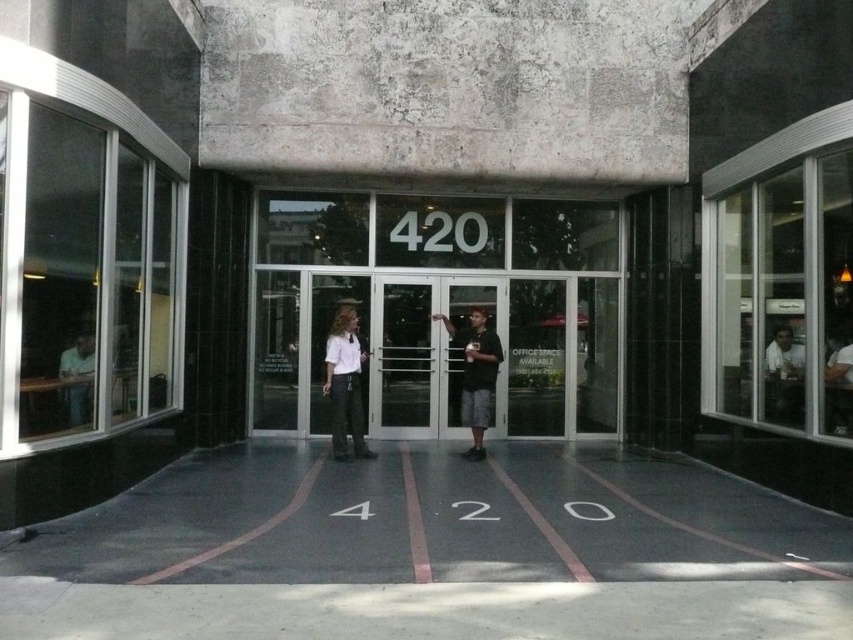
Is point (410, 448) farther from viewer compared to point (447, 326)?

Yes, point (410, 448) is farther from viewer.

Is black asphalt pavement at center wider than matte white shirt at center?

Incorrect, black asphalt pavement at center's width does not surpass matte white shirt at center's.

Locate an element on the screen. This screenshot has height=640, width=853. black asphalt pavement at center is located at coordinates (434, 522).

Find the location of `black asphalt pavement at center`. black asphalt pavement at center is located at coordinates (434, 522).

Which of these two, black asphalt pavement at center or transparent glass door at center, stands shorter?

Standing shorter between the two is black asphalt pavement at center.

The height and width of the screenshot is (640, 853). Describe the element at coordinates (434, 522) in the screenshot. I see `black asphalt pavement at center` at that location.

The image size is (853, 640). I want to click on black asphalt pavement at center, so click(434, 522).

Who is lower down, white glass doors at center or white shirt at center?

white shirt at center

Who is higher up, white glass doors at center or white shirt at center?

white glass doors at center is higher up.

This screenshot has height=640, width=853. Find the location of `white glass doors at center`. white glass doors at center is located at coordinates (439, 308).